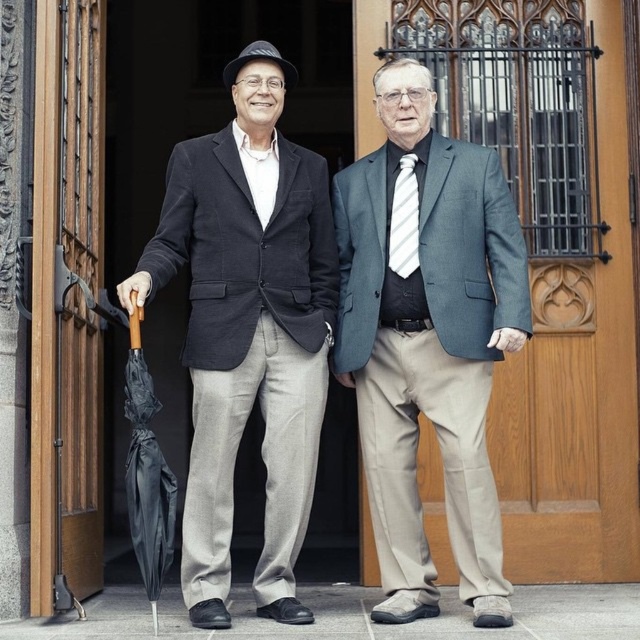
Between matte black suit at center and white striped tie at center, which one appears on the right side from the viewer's perspective?

matte black suit at center

Does matte black suit at center appear under white striped tie at center?

Correct, matte black suit at center is located below white striped tie at center.

Image resolution: width=640 pixels, height=640 pixels. Describe the element at coordinates (428, 342) in the screenshot. I see `matte black suit at center` at that location.

At what (x,y) coordinates should I click in order to perform the action: click on matte black suit at center. Please return your answer as a coordinate pair (x, y). This screenshot has height=640, width=640. Looking at the image, I should click on (428, 342).

I want to click on matte black suit at center, so click(428, 342).

Can you confirm if matte black suit at center is smaller than black matte umbrella at left?

Correct, matte black suit at center occupies less space than black matte umbrella at left.

Locate an element on the screen. This screenshot has width=640, height=640. matte black suit at center is located at coordinates (428, 342).

Where is `matte black suit at center`? matte black suit at center is located at coordinates (428, 342).

Is wooden door at left below black matte umbrella at left?

A: No.

Is point (80, 428) closer to viewer compared to point (131, 349)?

No, (80, 428) is further to viewer.

At what (x,y) coordinates should I click in order to perform the action: click on wooden door at left. Please return your answer as a coordinate pair (x, y). The image size is (640, 640). Looking at the image, I should click on (67, 301).